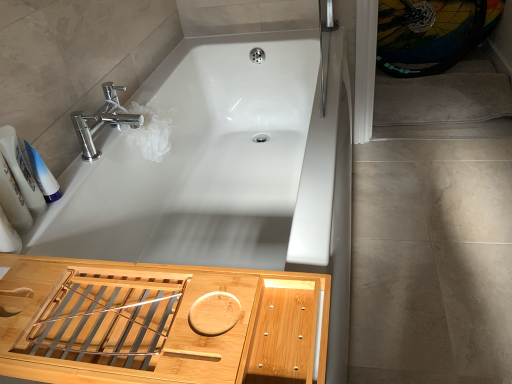
Question: Considering the relative sizes of white plastic tube at left, the second toiletry from the left, and white glossy bottles at left, the second toiletry from the right, in the image provided, is white plastic tube at left, the second toiletry from the left, shorter than white glossy bottles at left, the second toiletry from the right,?

Choices:
 (A) yes
 (B) no

Answer: (A)

Question: Is white plastic tube at left, the second toiletry from the left, oriented towards white glossy bottles at left, the 1th toiletry positioned from the left?

Choices:
 (A) no
 (B) yes

Answer: (B)

Question: Can you confirm if white plastic tube at left, which is counted as the 1th toiletry, starting from the right, is smaller than white glossy bottles at left, the 1th toiletry positioned from the left?

Choices:
 (A) no
 (B) yes

Answer: (B)

Question: Can you confirm if white plastic tube at left, the second toiletry from the left, is bigger than white glossy bottles at left, the 1th toiletry positioned from the left?

Choices:
 (A) no
 (B) yes

Answer: (A)

Question: Can you confirm if white plastic tube at left, which is counted as the 1th toiletry, starting from the right, is thinner than white glossy bottles at left, the second toiletry from the right?

Choices:
 (A) yes
 (B) no

Answer: (A)

Question: Would you say multicolored rubber bicycle wheel at upper right is inside or outside chrome/metallic faucet at upper left?

Choices:
 (A) inside
 (B) outside

Answer: (B)

Question: Is point (386, 6) closer or farther from the camera than point (106, 100)?

Choices:
 (A) farther
 (B) closer

Answer: (A)

Question: Looking at their shapes, would you say multicolored rubber bicycle wheel at upper right is wider or thinner than chrome/metallic faucet at upper left?

Choices:
 (A) wide
 (B) thin

Answer: (B)

Question: Visually, is multicolored rubber bicycle wheel at upper right positioned to the left or to the right of chrome/metallic faucet at upper left?

Choices:
 (A) right
 (B) left

Answer: (A)

Question: Is chrome/metallic faucet at upper left in front of or behind multicolored rubber bicycle wheel at upper right in the image?

Choices:
 (A) behind
 (B) front

Answer: (B)

Question: Considering the positions of chrome/metallic faucet at upper left and multicolored rubber bicycle wheel at upper right in the image, is chrome/metallic faucet at upper left bigger or smaller than multicolored rubber bicycle wheel at upper right?

Choices:
 (A) small
 (B) big

Answer: (A)

Question: From a real-world perspective, relative to multicolored rubber bicycle wheel at upper right, is chrome/metallic faucet at upper left vertically above or below?

Choices:
 (A) above
 (B) below

Answer: (A)

Question: Considering the positions of point (121, 107) and point (429, 3), is point (121, 107) closer or farther from the camera than point (429, 3)?

Choices:
 (A) farther
 (B) closer

Answer: (B)

Question: Relative to white glossy bottles at left, the second toiletry from the right, is white plastic tube at left, the second toiletry from the left, in front or behind?

Choices:
 (A) front
 (B) behind

Answer: (B)

Question: Is white plastic tube at left, which is counted as the 1th toiletry, starting from the right, taller or shorter than white glossy bottles at left, the 1th toiletry positioned from the left?

Choices:
 (A) short
 (B) tall

Answer: (A)